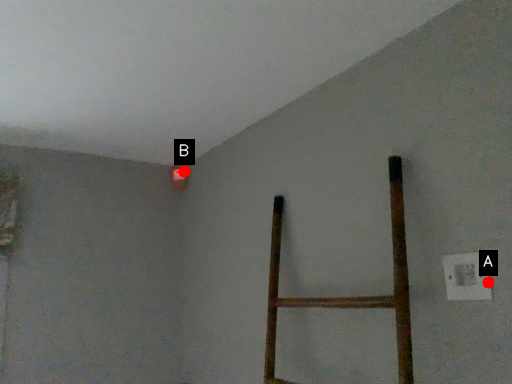
Question: Two points are circled on the image, labeled by A and B beside each circle. Which point is closer to the camera taking this photo?

Choices:
 (A) A is closer
 (B) B is closer

Answer: (A)